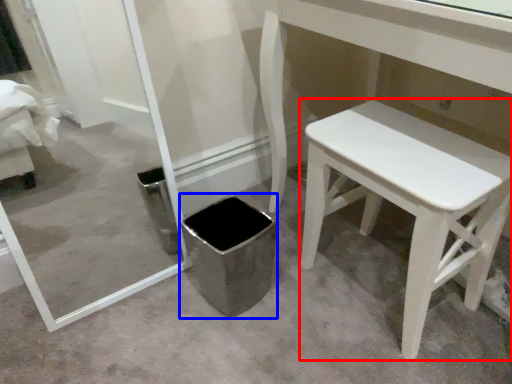
Question: Which point is further to the camera, stool (highlighted by a red box) or potty (highlighted by a blue box)?

Choices:
 (A) stool
 (B) potty

Answer: (B)